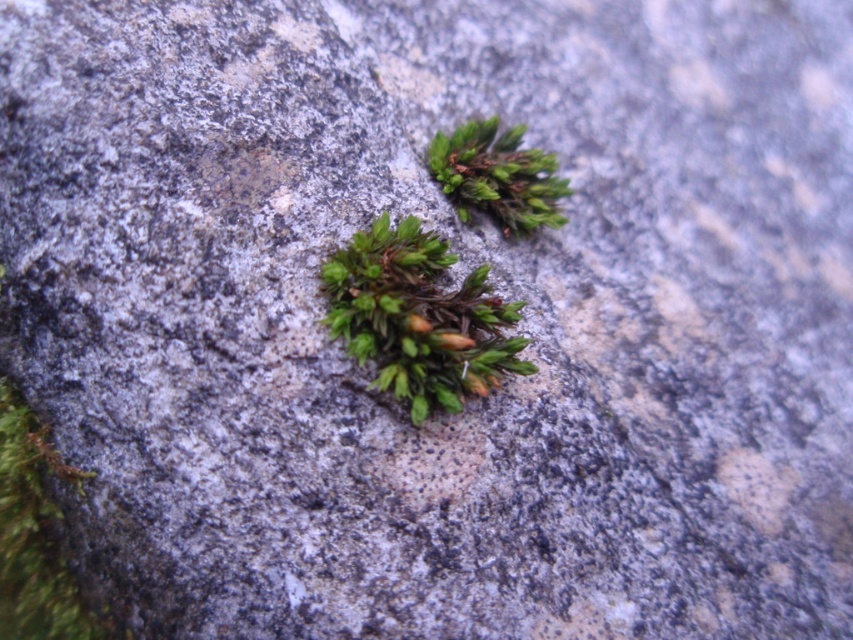
You are an explorer examining a rock surface. You notice two green fuzzy moss patches. Which one is nearer to your eyesight, the green fuzzy moss at center or the green fuzzy moss at upper center?

The green fuzzy moss at center is closer to the viewer than the green fuzzy moss at upper center.

You are a geologist examining a rock sample. You notice a point at coordinates point (486, 337) on the rock surface. If your measuring device can only focus on objects within 35 inches, will it be able to clearly observe this point?

The distance of point (486, 337) from the camera is 36.81 inches, which is beyond the 35 inches range of the measuring device. Therefore, the device cannot clearly observe this point.

You are a gardener trying to transplant both green fuzzy moss at center and green fuzzy moss at upper center to a new rock surface. The new rock surface has a space that is 8 inches wide. Will both mosses fit side by side without overlapping?

The distance between the green fuzzy moss at center and green fuzzy moss at upper center is 7.85 inches. Since the new rock surface has a space of 8 inches, which is slightly larger than the distance between them, both mosses can fit side by side without overlapping.